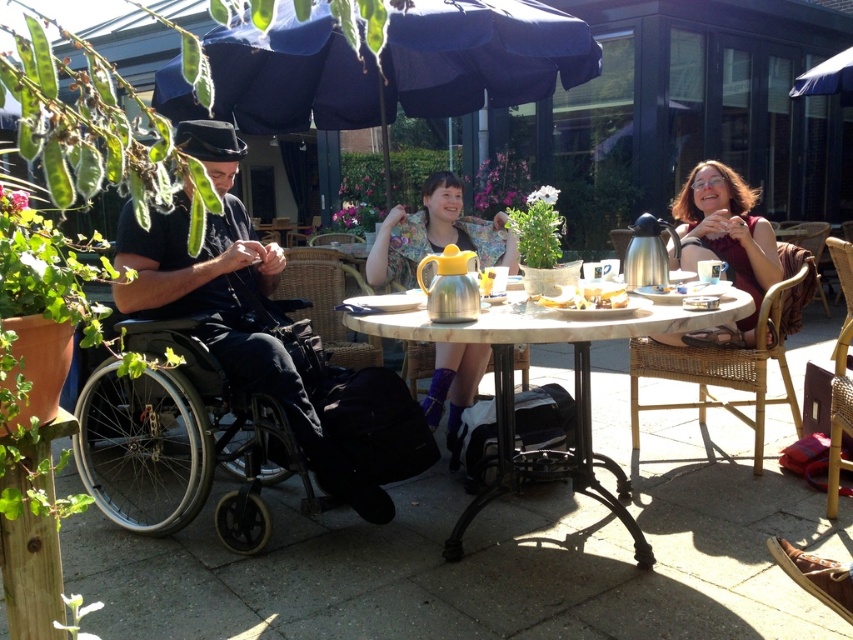
You are a photographer standing at the edge of the scene and want to take a photo of both the matte brown sweater at upper right and the yellow matte bread at center without any obstruction. Which object should you focus on first to ensure both are in frame?

You should focus on the matte brown sweater at upper right first because it is closer to you than the yellow matte bread at center, ensuring both will be in frame when properly aligned.

You are a customer at this outdoor table and want to pour tea into your cup using the metallic silver teapot at center. However, you notice the matte brown sweater at upper right is nearby. Is the teapot small enough to avoid knocking into the sweater when pouring?

The metallic silver teapot at center is smaller than the matte brown sweater at upper right, so it should be small enough to pour tea without knocking into the sweater.

You are standing at the edge of the patio and want to place a small plant between the two points marked in the image. Which point should you place it closer to so that it appears closer to you? The two points are point 1 at (753, 241) and point 2 at (566, 291).

You should place the plant closer to point 1 at (753, 241) because it is already further to the viewer than point 2 at (566, 291), making it appear closer to you.